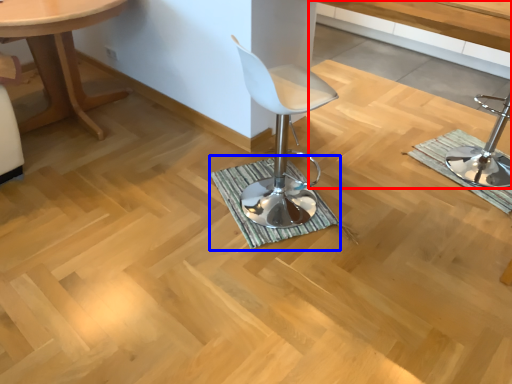
Question: Among these objects, which one is nearest to the camera, vanity (highlighted by a red box) or bath mat (highlighted by a blue box)?

Choices:
 (A) vanity
 (B) bath mat

Answer: (A)